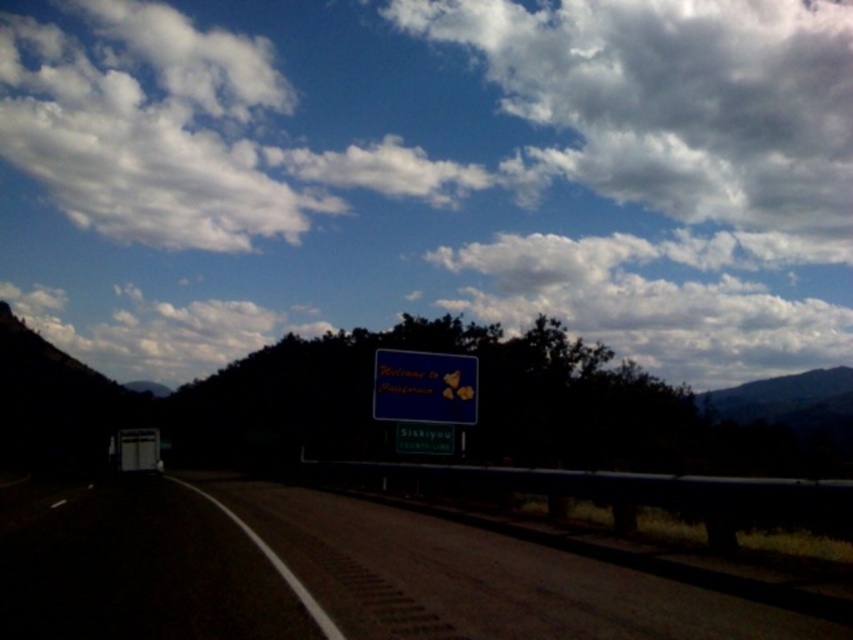
You are driving on the dark asphalt road at center and want to place a temporary traffic cone next to the green matte sign at center. Given the road space, will there be enough room to safely place the cone without obstructing traffic?

The dark asphalt road at center is wider than the green matte sign at center, so there should be sufficient space to place the cone safely next to the sign without blocking traffic lanes.

You are standing on the side of the highway and want to cross the dark asphalt road at center. The road is 4.89 meters wide. If your car is 2 meters wide, can you safely cross the road without hitting the guardrail on the right side?

The dark asphalt road at center is 4.89 meters wide. Since your car is 2 meters wide, there is enough space to cross safely as long as you stay within the road and avoid the guardrail on the right side.

You are a driver approaching the highway and see two points marked on the road ahead. The first point is at coordinates point [288,618] and the second is at point [386,372]. Which point is closer to your current position?

Point [288,618] is closer to the viewer than point [386,372], so the first point is closer to your current position.